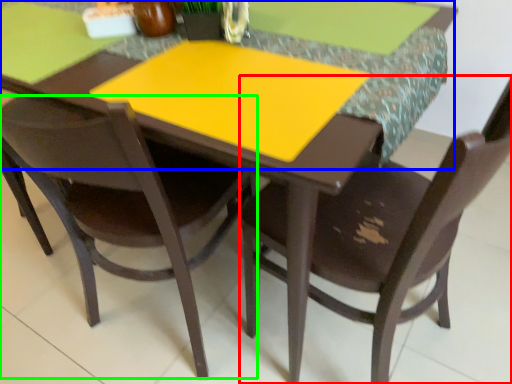
Question: Which object is the closest to the chair (highlighted by a red box)? Choose among these: counter top (highlighted by a blue box) or chair (highlighted by a green box).

Choices:
 (A) counter top
 (B) chair

Answer: (A)